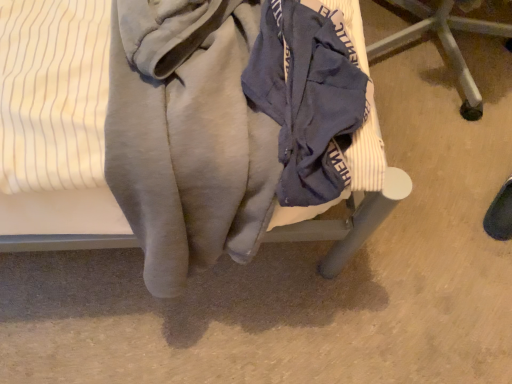
Question: Is velvet-like fabric chair at center, the first furniture in the left-to-right sequence, not close to blue fabric chair at center, which is the 2th furniture in left-to-right order?

Choices:
 (A) yes
 (B) no

Answer: (B)

Question: Is velvet-like fabric chair at center, the first furniture in the left-to-right sequence, located outside blue fabric chair at center, which is counted as the first furniture, starting from the right?

Choices:
 (A) no
 (B) yes

Answer: (B)

Question: Is velvet-like fabric chair at center, the first furniture in the left-to-right sequence, wider than blue fabric chair at center, which is counted as the first furniture, starting from the right?

Choices:
 (A) yes
 (B) no

Answer: (A)

Question: From a real-world perspective, is velvet-like fabric chair at center, the first furniture in the left-to-right sequence, below blue fabric chair at center, which is counted as the first furniture, starting from the right?

Choices:
 (A) no
 (B) yes

Answer: (A)

Question: From the image's perspective, is velvet-like fabric chair at center, the first furniture in the left-to-right sequence, beneath blue fabric chair at center, which is counted as the first furniture, starting from the right?

Choices:
 (A) no
 (B) yes

Answer: (B)

Question: From the image's perspective, relative to velvet-like fabric chair at center, the second furniture when ordered from right to left, is blue fabric chair at center, which is the 2th furniture in left-to-right order, above or below?

Choices:
 (A) below
 (B) above

Answer: (B)

Question: Would you say blue fabric chair at center, which is the 2th furniture in left-to-right order, is inside or outside velvet-like fabric chair at center, the first furniture in the left-to-right sequence?

Choices:
 (A) outside
 (B) inside

Answer: (A)

Question: Would you say blue fabric chair at center, which is counted as the first furniture, starting from the right, is to the left or to the right of velvet-like fabric chair at center, the first furniture in the left-to-right sequence, in the picture?

Choices:
 (A) left
 (B) right

Answer: (B)

Question: Considering the positions of blue fabric chair at center, which is the 2th furniture in left-to-right order, and velvet-like fabric chair at center, the second furniture when ordered from right to left, in the image, is blue fabric chair at center, which is the 2th furniture in left-to-right order, taller or shorter than velvet-like fabric chair at center, the second furniture when ordered from right to left,?

Choices:
 (A) short
 (B) tall

Answer: (A)

Question: Is point (309, 203) closer or farther from the camera than point (354, 218)?

Choices:
 (A) farther
 (B) closer

Answer: (B)

Question: Considering the positions of navy blue fabric at center and velvet-like fabric chair at center, the first furniture in the left-to-right sequence, in the image, is navy blue fabric at center bigger or smaller than velvet-like fabric chair at center, the first furniture in the left-to-right sequence,?

Choices:
 (A) small
 (B) big

Answer: (A)

Question: Is navy blue fabric at center to the left or to the right of velvet-like fabric chair at center, the second furniture when ordered from right to left, in the image?

Choices:
 (A) left
 (B) right

Answer: (B)

Question: From the image's perspective, is navy blue fabric at center positioned above or below velvet-like fabric chair at center, the second furniture when ordered from right to left?

Choices:
 (A) below
 (B) above

Answer: (A)

Question: Considering the positions of point (449, 56) and point (265, 3), is point (449, 56) closer or farther from the camera than point (265, 3)?

Choices:
 (A) farther
 (B) closer

Answer: (A)

Question: From the image's perspective, is blue fabric chair at center, which is counted as the first furniture, starting from the right, above or below navy blue fabric at center?

Choices:
 (A) below
 (B) above

Answer: (B)